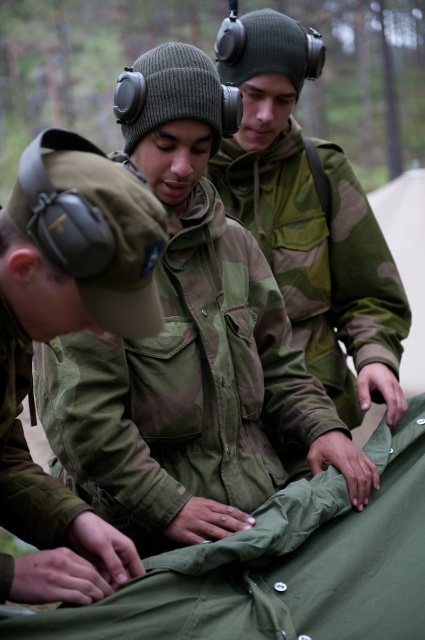
Does camouflage fabric jacket at center appear on the left side of matte green uniform at center?

In fact, camouflage fabric jacket at center is to the right of matte green uniform at center.

Who is more forward, (130, 378) or (2, 221)?

Point (2, 221)

Locate an element on the screen. The width and height of the screenshot is (425, 640). camouflage fabric jacket at center is located at coordinates click(190, 355).

Between point (30, 508) and point (345, 326), which one is positioned behind?

The point (345, 326) is behind.

Is the position of matte green uniform at center more distant than that of camouflage fabric jacket at upper center?

No, matte green uniform at center is closer to the viewer.

Is point (96, 300) positioned behind point (289, 305)?

No.

Where is `matte green uniform at center`? Image resolution: width=425 pixels, height=640 pixels. matte green uniform at center is located at coordinates (65, 333).

Which of these two, camouflage fabric jacket at center or camouflage fabric jacket at upper center, stands taller?

camouflage fabric jacket at upper center is taller.

Who is positioned more to the right, camouflage fabric jacket at center or camouflage fabric jacket at upper center?

From the viewer's perspective, camouflage fabric jacket at upper center appears more on the right side.

Who is more distant from viewer, (317, 440) or (373, 273)?

Point (373, 273)

Locate an element on the screen. This screenshot has height=640, width=425. camouflage fabric jacket at center is located at coordinates (190, 355).